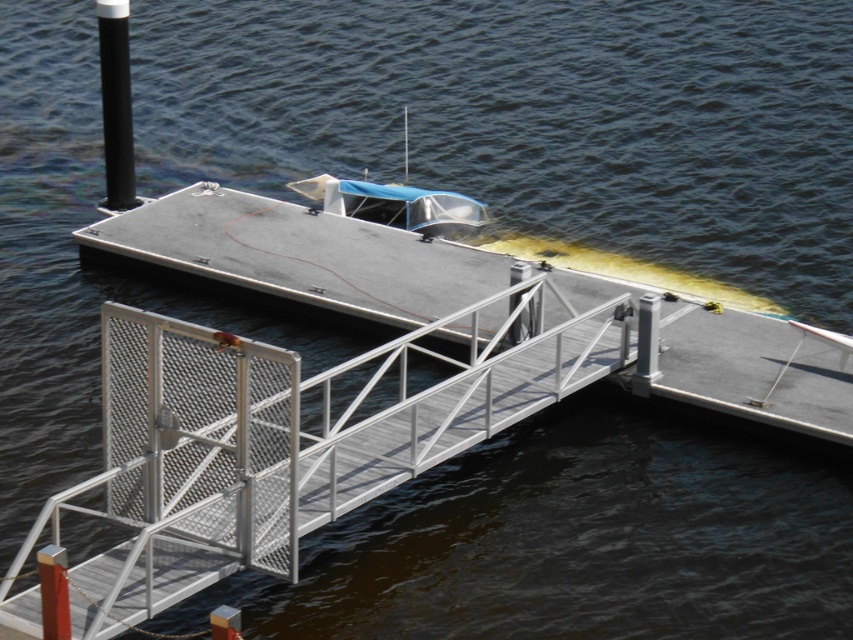
Question: Does metallic gray boat at center appear on the left side of black matte pole at upper left?

Choices:
 (A) yes
 (B) no

Answer: (B)

Question: Can you confirm if metallic silver rail at center is wider than black matte pole at upper left?

Choices:
 (A) yes
 (B) no

Answer: (B)

Question: Based on their relative distances, which object is farther from the metallic silver rail at center?

Choices:
 (A) black matte pole at upper left
 (B) metallic gray boat at center

Answer: (A)

Question: Does metallic silver rail at center lie behind metallic gray boat at center?

Choices:
 (A) no
 (B) yes

Answer: (B)

Question: Which object is farther from the camera taking this photo?

Choices:
 (A) black matte pole at upper left
 (B) metallic gray boat at center

Answer: (A)

Question: Which object is positioned closest to the black matte pole at upper left?

Choices:
 (A) metallic gray boat at center
 (B) metallic silver rail at center

Answer: (A)